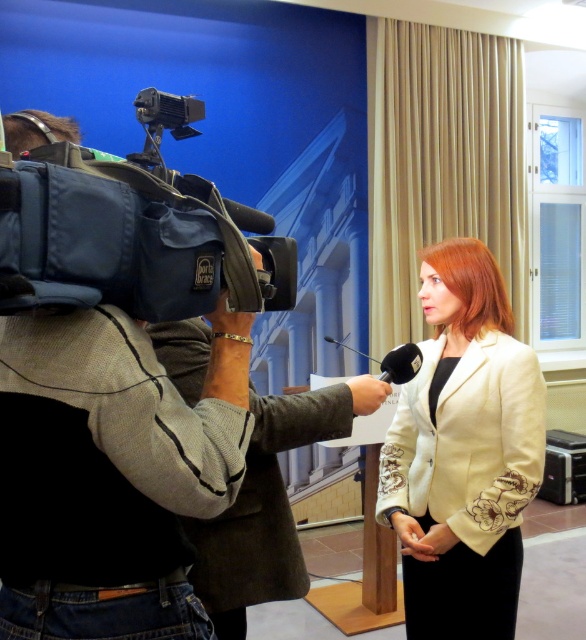
Is khaki fabric jacket at left below creamy satin blazer at center?

No, khaki fabric jacket at left is not below creamy satin blazer at center.

Between point (63, 497) and point (481, 467), which one is positioned in front?

Point (63, 497)

Who is more distant from viewer, [134,596] or [442,326]?

The point [442,326] is behind.

Where is `khaki fabric jacket at left`? khaki fabric jacket at left is located at coordinates (110, 474).

Between point (175, 225) and point (294, 396), which one is positioned behind?

Point (294, 396)

Who is positioned more to the right, blue fabric video camera at left or dark gray wool business suit at center?

From the viewer's perspective, dark gray wool business suit at center appears more on the right side.

Does point (148, 264) lie behind point (321, 408)?

No.

Find the location of a particular element. This screenshot has width=586, height=640. blue fabric video camera at left is located at coordinates (132, 228).

Identify the location of khaki fabric jacket at left. (110, 474).

I want to click on khaki fabric jacket at left, so click(x=110, y=474).